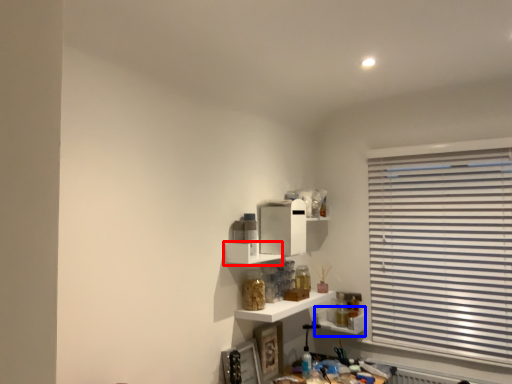
Question: Which object appears farthest to the camera in this image, shelf (highlighted by a red box) or shelf (highlighted by a blue box)?

Choices:
 (A) shelf
 (B) shelf

Answer: (B)